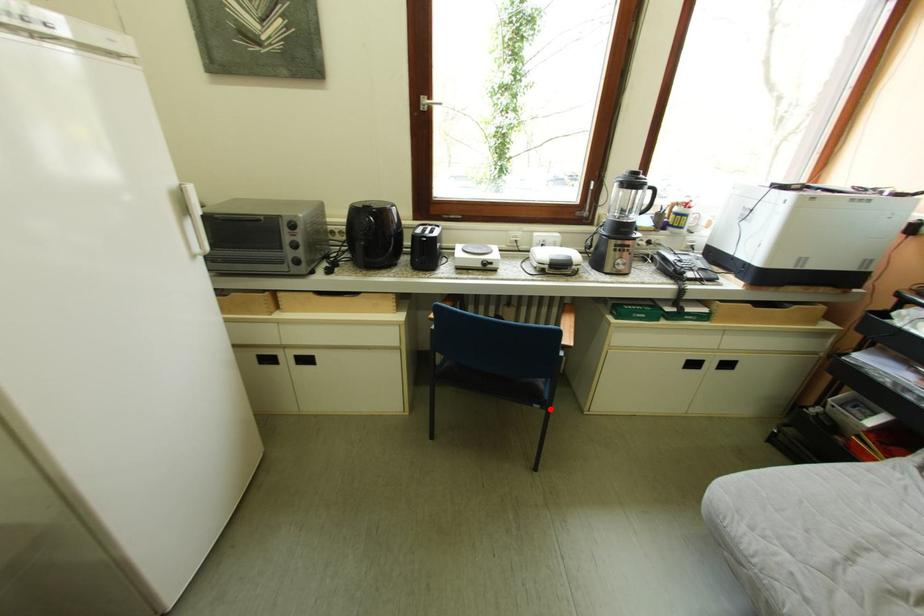
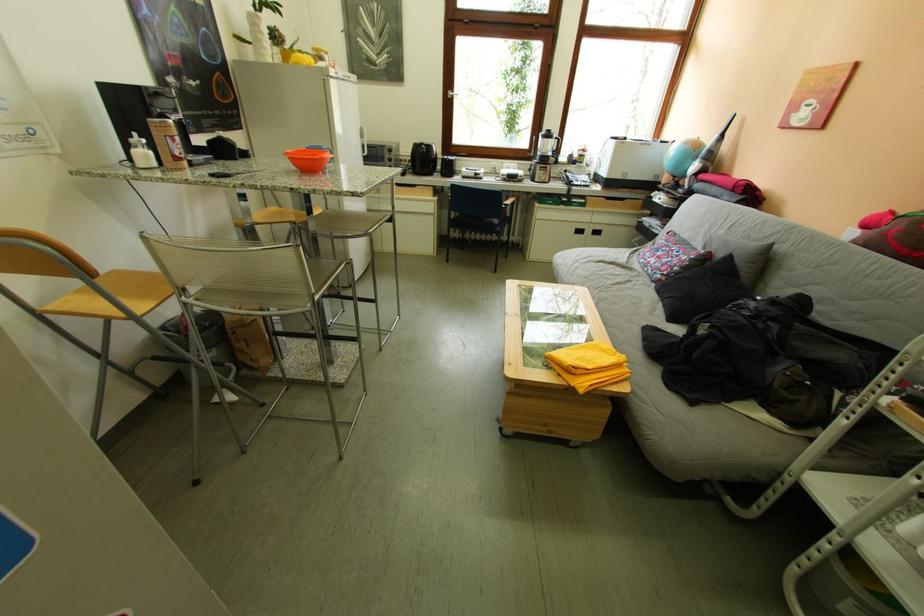
Question: I am providing you with two images of the same scene from different viewpoints. Image1 has a red point marked. In image2, the corresponding 3D location appears at what relative position? Reply with the corresponding letter.

Choices:
 (A) Closer
 (B) Farther

Answer: (A)